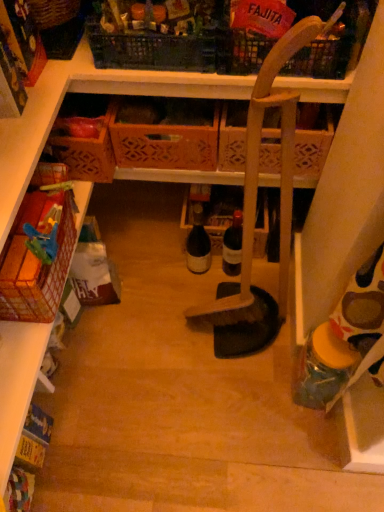
How much space does red plastic basket at upper center, positioned as the 6th basket in bottom-to-top order, occupy horizontally?

The width of red plastic basket at upper center, positioned as the 6th basket in bottom-to-top order, is 14.39 inches.

In order to face red plastic basket at upper center, positioned as the first basket in top-to-bottom order, should I rotate leftwards or rightwards?

To align with it, rotate right about 11.075°.

Locate an element on the screen. woven brown basket at upper left, which is counted as the 5th basket, starting from the bottom is located at coordinates (58, 26).

Identify the location of matte glass bottle at center, placed as the 2th bottle when sorted from right to left. This screenshot has height=512, width=384. (198, 243).

Where is `wooden crate at center, the fourth basket positioned from the top`? wooden crate at center, the fourth basket positioned from the top is located at coordinates (165, 133).

Measure the distance between wooden crate at center, the fourth basket positioned from the top, and camera.

They are 3.77 feet apart.

What is the approximate width of wooden broom at center?

8.56 inches.

Where is `red mesh basket at left, which ranks as the first basket in bottom-to-top order`? This screenshot has height=512, width=384. red mesh basket at left, which ranks as the first basket in bottom-to-top order is located at coordinates (38, 258).

Which object is further away from the camera taking this photo, red mesh basket at left, which ranks as the first basket in bottom-to-top order, or wooden crate at center, the 5th basket positioned from the top?

wooden crate at center, the 5th basket positioned from the top, is behind.

Consider the image. Is red mesh basket at left, which ranks as the first basket in bottom-to-top order, turned away from wooden crate at center, the 5th basket positioned from the top?

red mesh basket at left, which ranks as the first basket in bottom-to-top order, is not turned away from wooden crate at center, the 5th basket positioned from the top.

Consider the image. From the image's perspective, is red mesh basket at left, which ranks as the first basket in bottom-to-top order, located above or below wooden crate at center, the 5th basket positioned from the top?

red mesh basket at left, which ranks as the first basket in bottom-to-top order, is below wooden crate at center, the 5th basket positioned from the top.

Which is more to the left, red mesh basket at left, which appears as the 6th basket when viewed from the top, or wooden crate at center, the 5th basket positioned from the top?

From the viewer's perspective, red mesh basket at left, which appears as the 6th basket when viewed from the top, appears more on the left side.

Is wooden crate at center, the 5th basket positioned from the top, positioned with its back to plastic crate at upper center, marked as the fourth basket in a bottom-to-top arrangement?

No, wooden crate at center, the 5th basket positioned from the top,'s orientation is not away from plastic crate at upper center, marked as the fourth basket in a bottom-to-top arrangement.

Considering the sizes of objects wooden crate at center, which appears as the 2th basket when ordered from the bottom, and plastic crate at upper center, marked as the fourth basket in a bottom-to-top arrangement, in the image provided, who is wider, wooden crate at center, which appears as the 2th basket when ordered from the bottom, or plastic crate at upper center, marked as the fourth basket in a bottom-to-top arrangement,?

Wider between the two is wooden crate at center, which appears as the 2th basket when ordered from the bottom.

Is wooden crate at center, the 5th basket positioned from the top, smaller than plastic crate at upper center, which is the third basket from top to bottom?

Yes, wooden crate at center, the 5th basket positioned from the top, is smaller than plastic crate at upper center, which is the third basket from top to bottom.

Between point (59, 122) and point (113, 33), which one is positioned behind?

Positioned behind is point (59, 122).

Is wooden broom at center positioned with its back to red mesh basket at left, which appears as the 6th basket when viewed from the top?

No, wooden broom at center is not facing the opposite direction of red mesh basket at left, which appears as the 6th basket when viewed from the top.

Which object is closer to the camera taking this photo, wooden broom at center or red mesh basket at left, which ranks as the first basket in bottom-to-top order?

Positioned in front is wooden broom at center.

Where is `chair above the red mesh basket at left, which ranks as the first basket in bottom-to-top order (from the image's perspective)`? This screenshot has height=512, width=384. chair above the red mesh basket at left, which ranks as the first basket in bottom-to-top order (from the image's perspective) is located at coordinates (254, 215).

Considering the relative positions of wooden broom at center and red mesh basket at left, which ranks as the first basket in bottom-to-top order, in the image provided, is wooden broom at center to the left of red mesh basket at left, which ranks as the first basket in bottom-to-top order, from the viewer's perspective?

In fact, wooden broom at center is to the right of red mesh basket at left, which ranks as the first basket in bottom-to-top order.

Between point (218, 127) and point (312, 58), which one is positioned in front?

The point (312, 58) is closer.

Between wooden crate at center, the fourth basket positioned from the top, and red plastic basket at upper center, positioned as the first basket in top-to-bottom order, which one appears on the left side from the viewer's perspective?

Positioned to the left is wooden crate at center, the fourth basket positioned from the top.

Does wooden crate at center, the fourth basket positioned from the top, have a smaller size compared to red plastic basket at upper center, positioned as the first basket in top-to-bottom order?

Yes.

Where is `the 3rd basket above the wooden crate at center, which is counted as the 3th basket, starting from the bottom (from the image's perspective)`? the 3rd basket above the wooden crate at center, which is counted as the 3th basket, starting from the bottom (from the image's perspective) is located at coordinates (243, 51).

Is red mesh basket at left, which appears as the 6th basket when viewed from the top, situated inside plastic crate at upper center, which is the third basket from top to bottom, or outside?

red mesh basket at left, which appears as the 6th basket when viewed from the top, is located beyond the bounds of plastic crate at upper center, which is the third basket from top to bottom.

From a real-world perspective, starting from the plastic crate at upper center, which is the third basket from top to bottom, which basket is the 3rd one below it? Please provide its 2D coordinates.

[(38, 258)]

Is red mesh basket at left, which ranks as the first basket in bottom-to-top order, further to camera compared to plastic crate at upper center, which is the third basket from top to bottom?

No.

Is wooden crate at center, the 5th basket positioned from the top, looking in the opposite direction of red mesh basket at left, which ranks as the first basket in bottom-to-top order?

wooden crate at center, the 5th basket positioned from the top, is not turned away from red mesh basket at left, which ranks as the first basket in bottom-to-top order.

Based on their sizes in the image, would you say wooden crate at center, the 5th basket positioned from the top, is bigger or smaller than red mesh basket at left, which appears as the 6th basket when viewed from the top?

In the image, wooden crate at center, the 5th basket positioned from the top, appears to be smaller than red mesh basket at left, which appears as the 6th basket when viewed from the top.

Is wooden crate at center, the 5th basket positioned from the top, next to red mesh basket at left, which ranks as the first basket in bottom-to-top order, and touching it?

No, wooden crate at center, the 5th basket positioned from the top, is not in contact with red mesh basket at left, which ranks as the first basket in bottom-to-top order.

Does point (85, 138) appear closer or farther from the camera than point (316, 328)?

Point (85, 138) appears to be farther away from the viewer than point (316, 328).

Is wooden crate at center, the 5th basket positioned from the top, positioned with its back to translucent plastic jar at lower right, which ranks as the second bottle in left-to-right order?

No, translucent plastic jar at lower right, which ranks as the second bottle in left-to-right order, is not at the back of wooden crate at center, the 5th basket positioned from the top.

Considering the relative sizes of wooden crate at center, which appears as the 2th basket when ordered from the bottom, and translucent plastic jar at lower right, which ranks as the second bottle in left-to-right order, in the image provided, is wooden crate at center, which appears as the 2th basket when ordered from the bottom, smaller than translucent plastic jar at lower right, which ranks as the second bottle in left-to-right order,?

No, wooden crate at center, which appears as the 2th basket when ordered from the bottom, is not smaller than translucent plastic jar at lower right, which ranks as the second bottle in left-to-right order.

Is translucent plastic jar at lower right, which is the first bottle in right-to-left order, inside wooden crate at center, the 5th basket positioned from the top?

No, translucent plastic jar at lower right, which is the first bottle in right-to-left order, is not surrounded by wooden crate at center, the 5th basket positioned from the top.

This screenshot has height=512, width=384. In order to click on basket that is the 1st object to the left of the wooden crate at center, the 5th basket positioned from the top, starting at the anchor in this screenshot , I will do (x=38, y=258).

The image size is (384, 512). In order to click on the 2nd basket behind the plastic crate at upper center, which is the third basket from top to bottom, counting from the anchor's position in this screenshot , I will do `click(84, 137)`.

Estimate the real-world distances between objects in this image. Which object is further from red mesh basket at left, which ranks as the first basket in bottom-to-top order, wooden crate at center, which is counted as the 3th basket, starting from the bottom, or plastic crate at upper center, marked as the fourth basket in a bottom-to-top arrangement?

plastic crate at upper center, marked as the fourth basket in a bottom-to-top arrangement, lies further to red mesh basket at left, which ranks as the first basket in bottom-to-top order, than the other object.

From the image, which object appears to be farther from red plastic basket at upper center, positioned as the first basket in top-to-bottom order, wooden crate at center, the 5th basket positioned from the top, or plastic crate at upper center, which is the third basket from top to bottom?

The object further to red plastic basket at upper center, positioned as the first basket in top-to-bottom order, is wooden crate at center, the 5th basket positioned from the top.

In the scene shown: When comparing their distances from woven brown basket at upper left, which is counted as the 5th basket, starting from the bottom, does wooden crate at center, the fourth basket positioned from the top, or matte glass bottle at center, which appears as the second bottle when ordered from the bottom, seem closer?

The object closer to woven brown basket at upper left, which is counted as the 5th basket, starting from the bottom, is wooden crate at center, the fourth basket positioned from the top.

Based on their spatial positions, is red plastic basket at upper center, positioned as the 6th basket in bottom-to-top order, or matte glass bottle at center, the 1th bottle from the top, further from wooden crate at center, which appears as the 2th basket when ordered from the bottom?

Among the two, matte glass bottle at center, the 1th bottle from the top, is located further to wooden crate at center, which appears as the 2th basket when ordered from the bottom.

From the image, which object appears to be farther from woven brown basket at upper left, placed as the 2th basket when sorted from top to bottom, wooden crate at center, the fourth basket positioned from the top, or red mesh basket at left, which appears as the 6th basket when viewed from the top?

red mesh basket at left, which appears as the 6th basket when viewed from the top, lies further to woven brown basket at upper left, placed as the 2th basket when sorted from top to bottom, than the other object.

Consider the image. Based on their spatial positions, is wooden crate at center, the fourth basket positioned from the top, or translucent plastic jar at lower right, positioned as the first bottle in front-to-back order, closer to red plastic basket at upper center, positioned as the 6th basket in bottom-to-top order?

Based on the image, wooden crate at center, the fourth basket positioned from the top, appears to be nearer to red plastic basket at upper center, positioned as the 6th basket in bottom-to-top order.

Which object lies nearer to the anchor point red plastic basket at upper center, positioned as the first basket in top-to-bottom order, red mesh basket at left, which ranks as the first basket in bottom-to-top order, or matte glass bottle at center, which appears as the second bottle when ordered from the bottom?

red mesh basket at left, which ranks as the first basket in bottom-to-top order, is positioned closer to the anchor red plastic basket at upper center, positioned as the first basket in top-to-bottom order.

When comparing their distances from translucent plastic jar at lower right, which ranks as the second bottle in left-to-right order, does red plastic basket at upper center, positioned as the 6th basket in bottom-to-top order, or woven brown basket at upper left, placed as the 2th basket when sorted from top to bottom, seem further?

woven brown basket at upper left, placed as the 2th basket when sorted from top to bottom, lies further to translucent plastic jar at lower right, which ranks as the second bottle in left-to-right order, than the other object.

I want to click on chair between plastic crate at upper center, which is the third basket from top to bottom, and red mesh basket at left, which ranks as the first basket in bottom-to-top order, vertically, so click(x=254, y=215).

The width and height of the screenshot is (384, 512). In order to click on chair between woven brown basket at upper left, placed as the 2th basket when sorted from top to bottom, and translucent plastic jar at lower right, which is the first bottle in right-to-left order, from top to bottom in this screenshot , I will do `click(254, 215)`.

The width and height of the screenshot is (384, 512). In order to click on bottle that lies between plastic crate at upper center, which is the third basket from top to bottom, and translucent plastic jar at lower right, acting as the second bottle starting from the top, from top to bottom in this screenshot , I will do `click(198, 243)`.

The width and height of the screenshot is (384, 512). I want to click on chair between red plastic basket at upper center, positioned as the 6th basket in bottom-to-top order, and translucent plastic jar at lower right, the second bottle viewed from the back, vertically, so click(x=254, y=215).